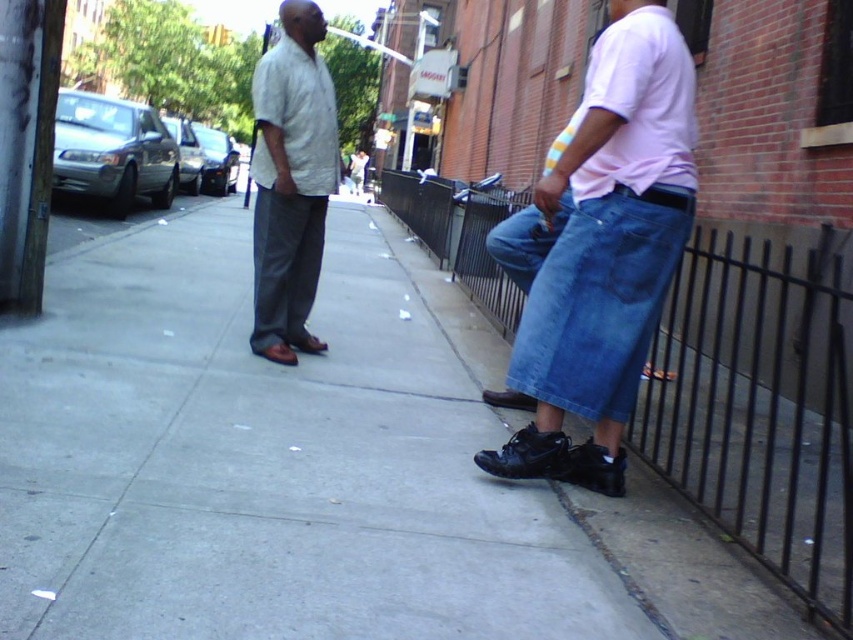
You are a fashion designer observing two people on a sidewalk. You notice the denim jeans at right and the dark gray cotton pants at center. Which clothing item is positioned further to the right?

The denim jeans at right is positioned further to the right than the dark gray cotton pants at center according to the description.

You are a fashion designer observing two people on a sidewalk. You notice the blue denim jeans at lower right and the dark gray cotton pants at center. Which of these two items of clothing is shorter in length?

The blue denim jeans at lower right is not as tall as dark gray cotton pants at center, so the blue denim jeans at lower right is shorter in length.

You are a fashion designer observing the urban street scene. You need to determine which clothing item is taller between the denim jeans at right and the light gray cotton shirt at center. Based on the scene description, which one is taller?

The denim jeans at right is much taller than the light gray cotton shirt at center according to the scene description.